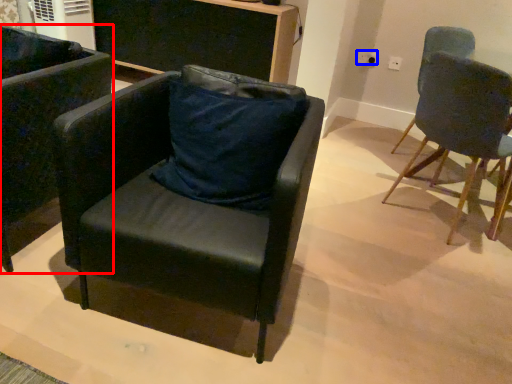
Question: Among these objects, which one is farthest to the camera, chair (highlighted by a red box) or power outlet (highlighted by a blue box)?

Choices:
 (A) chair
 (B) power outlet

Answer: (B)